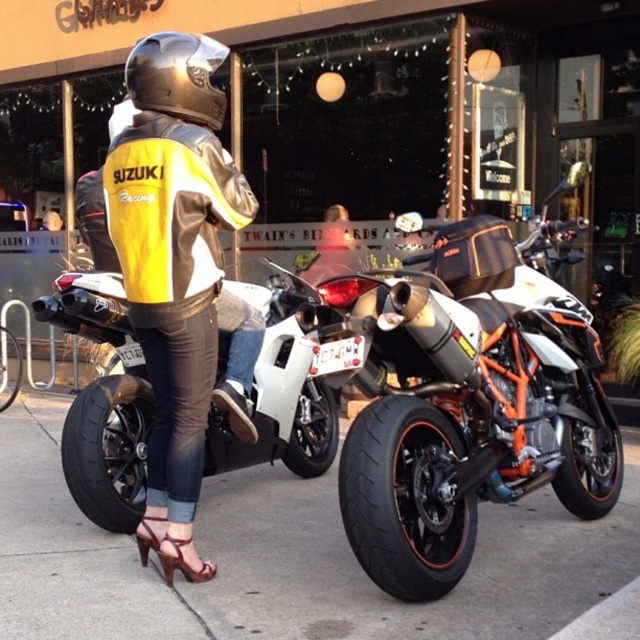
Question: Which point is farther to the camera?

Choices:
 (A) orange matte/satin motorcycle at center
 (B) yellow/black leather jacket at center
 (C) white matte sportbike at center

Answer: (C)

Question: Does orange matte/satin motorcycle at center have a larger size compared to black asphalt pavement at lower center?

Choices:
 (A) yes
 (B) no

Answer: (A)

Question: Estimate the real-world distances between objects in this image. Which object is farther from the shiny metallic helmet at center?

Choices:
 (A) white matte sportbike at center
 (B) yellow/black leather jacket at center

Answer: (A)

Question: Can you confirm if orange matte/satin motorcycle at center is positioned to the right of yellow/black leather jacket at center?

Choices:
 (A) yes
 (B) no

Answer: (A)

Question: Which object appears closest to the camera in this image?

Choices:
 (A) yellow/black leather jacket at center
 (B) orange matte/satin motorcycle at center
 (C) white matte sportbike at center

Answer: (B)

Question: Does black asphalt pavement at lower center lie behind yellow/black leather jacket at center?

Choices:
 (A) yes
 (B) no

Answer: (B)